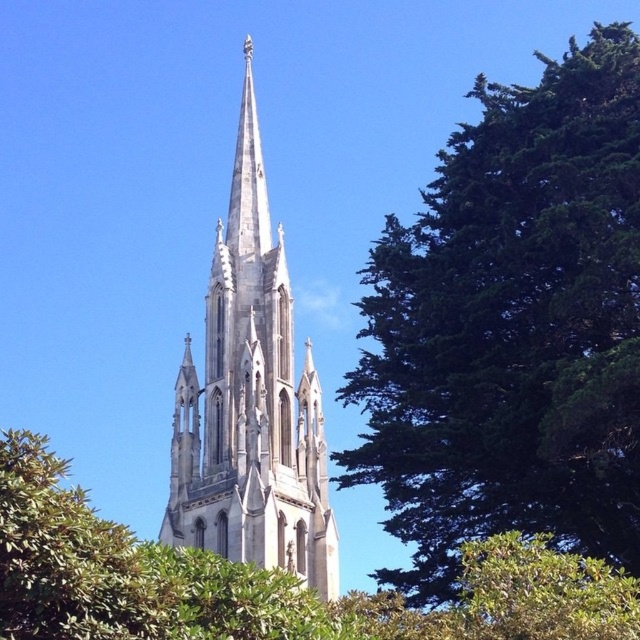
Question: Among these objects, which one is nearest to the camera?

Choices:
 (A) green leafy tree at upper right
 (B) green leafy tree at center

Answer: (B)

Question: Which is farther from the green leafy tree at upper right?

Choices:
 (A) green leafy tree at center
 (B) white stone spire at center

Answer: (B)

Question: Is green leafy tree at upper right smaller than green leafy tree at center?

Choices:
 (A) yes
 (B) no

Answer: (B)

Question: Does green leafy tree at upper right appear on the left side of white stone spire at center?

Choices:
 (A) no
 (B) yes

Answer: (A)

Question: Can you confirm if green leafy tree at upper right is positioned to the left of white stone spire at center?

Choices:
 (A) yes
 (B) no

Answer: (B)

Question: Which point is farther to the camera?

Choices:
 (A) (228, 460)
 (B) (524, 616)

Answer: (A)